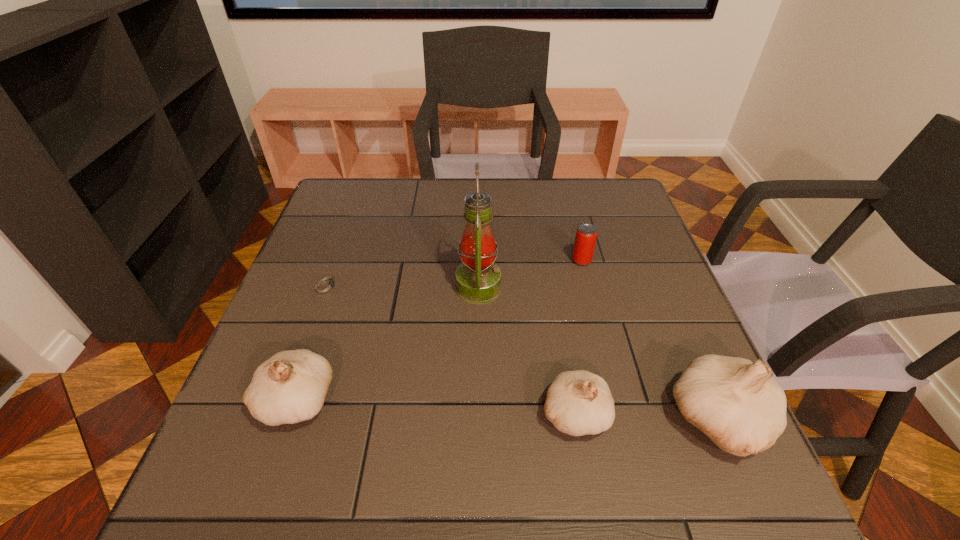
I want to click on the second tallest garlic, so click(290, 387).

Locate an element on the screen. the fourth shortest object is located at coordinates (290, 387).

Where is `the shortest garlic`? the shortest garlic is located at coordinates (578, 403).

This screenshot has width=960, height=540. What are the coordinates of `the rightmost garlic` in the screenshot? It's located at (737, 403).

I want to click on oil lamp, so click(478, 279).

Image resolution: width=960 pixels, height=540 pixels. In order to click on the fourth object from right to left in this screenshot , I will do `click(478, 279)`.

Identify the location of the shortest object. (326, 285).

Where is `the fifth tallest object`? This screenshot has height=540, width=960. the fifth tallest object is located at coordinates (586, 235).

You are a GUI agent. You are given a task and a screenshot of the screen. Output one action in this format:
    pyautogui.click(x=<x>, y=<y>)
    Task: Click on the vacant space located on the back of the second shortest garlic
    This screenshot has height=540, width=960.
    Given the screenshot: What is the action you would take?
    pyautogui.click(x=321, y=329)

Find the location of a particular element. Image resolution: width=960 pixels, height=540 pixels. free location located 0.060m on the back of the second garlic from right to left is located at coordinates (565, 360).